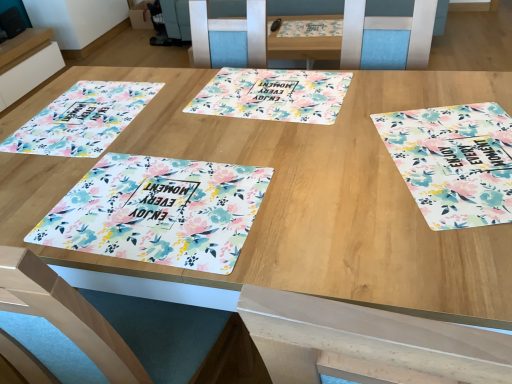
Where is `blank space to the left of floral fabric placemat at right, which is the third tablecloth in left-to-right order`? The width and height of the screenshot is (512, 384). blank space to the left of floral fabric placemat at right, which is the third tablecloth in left-to-right order is located at coordinates (322, 177).